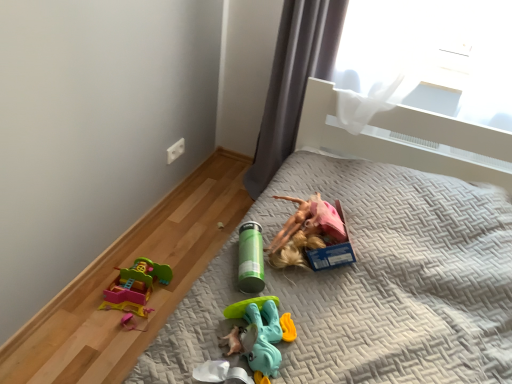
Question: Can we say gray fabric curtain at upper right lies outside translucent plastic toy at center, acting as the second toy starting from the top?

Choices:
 (A) no
 (B) yes

Answer: (B)

Question: Are gray fabric curtain at upper right and translucent plastic toy at center, acting as the second toy starting from the top, making contact?

Choices:
 (A) yes
 (B) no

Answer: (B)

Question: Does gray fabric curtain at upper right have a lesser height compared to translucent plastic toy at center, acting as the first toy starting from the bottom?

Choices:
 (A) no
 (B) yes

Answer: (A)

Question: Would you consider gray fabric curtain at upper right to be distant from translucent plastic toy at center, which ranks as the first toy in front-to-back order?

Choices:
 (A) yes
 (B) no

Answer: (A)

Question: Does gray fabric curtain at upper right lie behind translucent plastic toy at center, acting as the second toy starting from the top?

Choices:
 (A) yes
 (B) no

Answer: (A)

Question: From the image's perspective, is gray quilted bed at center above or below green matte thermos at center, arranged as the first toy when viewed from the top?

Choices:
 (A) above
 (B) below

Answer: (B)

Question: Based on their positions, is gray quilted bed at center located to the left or right of green matte thermos at center, arranged as the first toy when viewed from the top?

Choices:
 (A) left
 (B) right

Answer: (B)

Question: Looking at their shapes, would you say gray quilted bed at center is wider or thinner than green matte thermos at center, which is counted as the 2th toy, starting from the bottom?

Choices:
 (A) wide
 (B) thin

Answer: (A)

Question: From their relative heights in the image, would you say gray quilted bed at center is taller or shorter than green matte thermos at center, which is counted as the 2th toy, starting from the bottom?

Choices:
 (A) short
 (B) tall

Answer: (B)

Question: Is gray quilted bed at center to the left or to the right of gray fabric curtain at upper right in the image?

Choices:
 (A) right
 (B) left

Answer: (A)

Question: From a real-world perspective, is gray quilted bed at center above or below gray fabric curtain at upper right?

Choices:
 (A) below
 (B) above

Answer: (A)

Question: Considering the positions of gray quilted bed at center and gray fabric curtain at upper right in the image, is gray quilted bed at center bigger or smaller than gray fabric curtain at upper right?

Choices:
 (A) big
 (B) small

Answer: (A)

Question: Considering their positions, is gray quilted bed at center located in front of or behind gray fabric curtain at upper right?

Choices:
 (A) front
 (B) behind

Answer: (A)

Question: Is gray fabric curtain at upper right wider or thinner than gray quilted bed at center?

Choices:
 (A) thin
 (B) wide

Answer: (A)

Question: Is gray fabric curtain at upper right bigger or smaller than gray quilted bed at center?

Choices:
 (A) small
 (B) big

Answer: (A)